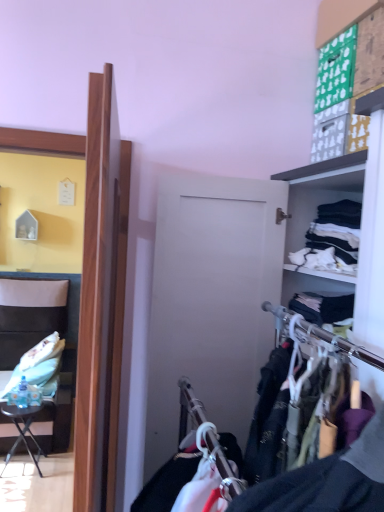
Question: Does point (329, 245) appear closer or farther from the camera than point (21, 336)?

Choices:
 (A) closer
 (B) farther

Answer: (A)

Question: Looking at the image, does white cotton shirts at right, which is the second clothing from left to right, seem bigger or smaller compared to leatherette chair at left?

Choices:
 (A) small
 (B) big

Answer: (A)

Question: Which object is positioned closest to the white cotton shirts at right, the 1th clothing in the top-to-bottom sequence?

Choices:
 (A) leatherette chair at left
 (B) black metal table at lower left
 (C) white fabric pillow at left, arranged as the second clothing when viewed from the right

Answer: (C)

Question: Based on their relative distances, which object is nearer to the white cotton shirts at right, which is the second clothing from bottom to top?

Choices:
 (A) black metal table at lower left
 (B) white fabric pillow at left, the 1th clothing in the back-to-front sequence
 (C) leatherette chair at left

Answer: (B)